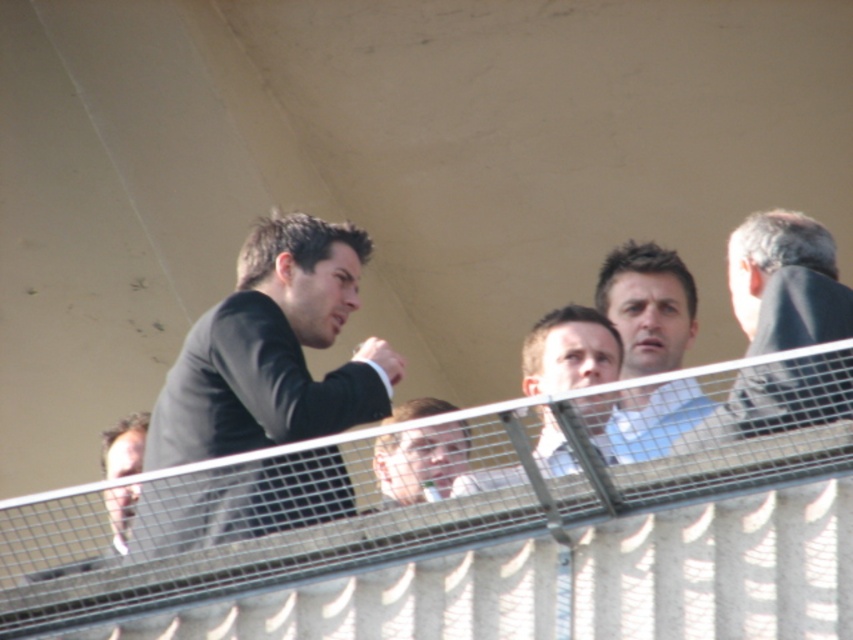
Can you confirm if metal mesh fence at center is bigger than dark gray suit at right?

Yes.

The image size is (853, 640). Describe the element at coordinates (476, 529) in the screenshot. I see `metal mesh fence at center` at that location.

Identify the location of metal mesh fence at center. (476, 529).

Who is lower down, metal mesh fence at center or smooth brown hair at left?

metal mesh fence at center is below.

From the picture: Is metal mesh fence at center behind smooth brown hair at left?

No.

Describe the element at coordinates (476, 529) in the screenshot. I see `metal mesh fence at center` at that location.

This screenshot has height=640, width=853. I want to click on metal mesh fence at center, so click(476, 529).

Which of these two, metal mesh fence at center or light blue shirt at center, stands shorter?

With less height is light blue shirt at center.

Is point (48, 545) more distant than point (581, 346)?

No.

Identify the location of metal mesh fence at center. (476, 529).